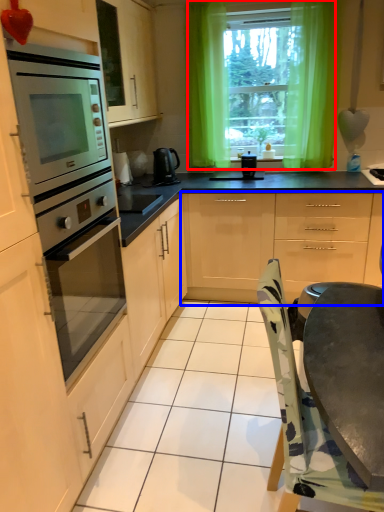
Question: Which of the following is the closest to the observer, window (highlighted by a red box) or cabinetry (highlighted by a blue box)?

Choices:
 (A) window
 (B) cabinetry

Answer: (B)